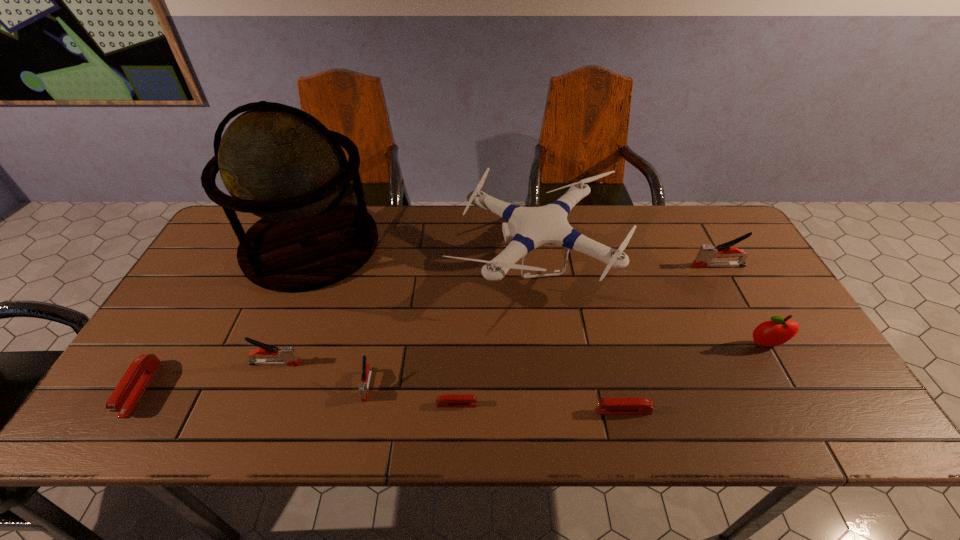
Locate an element on the screen. vacant space located 0.130m on the handle side of the farthest gray stapler is located at coordinates (650, 266).

Locate an element on the screen. Image resolution: width=960 pixels, height=540 pixels. blank space located on the right of the sixth nearest object is located at coordinates (805, 345).

The height and width of the screenshot is (540, 960). I want to click on free space located on the handle side of the second farthest gray stapler, so click(452, 363).

Where is `vacant space situated 0.110m on the front-facing side of the fifth stapler from left to right`? vacant space situated 0.110m on the front-facing side of the fifth stapler from left to right is located at coordinates (548, 411).

Where is `vacant point located 0.310m on the front-facing side of the fifth stapler from left to right`? This screenshot has height=540, width=960. vacant point located 0.310m on the front-facing side of the fifth stapler from left to right is located at coordinates pyautogui.click(x=458, y=411).

Where is `free space located 0.100m on the front-facing side of the fifth stapler from left to right`? free space located 0.100m on the front-facing side of the fifth stapler from left to right is located at coordinates (552, 411).

This screenshot has width=960, height=540. I want to click on free point located on the front-facing side of the third stapler from right to left, so click(618, 404).

The width and height of the screenshot is (960, 540). Identify the location of globe at the far edge. click(x=280, y=163).

At what (x,y) coordinates should I click in order to perform the action: click on drone that is at the far edge. Please return your answer as a coordinate pair (x, y). Image resolution: width=960 pixels, height=540 pixels. Looking at the image, I should click on (527, 228).

Image resolution: width=960 pixels, height=540 pixels. Identify the location of globe that is at the left edge. (280, 163).